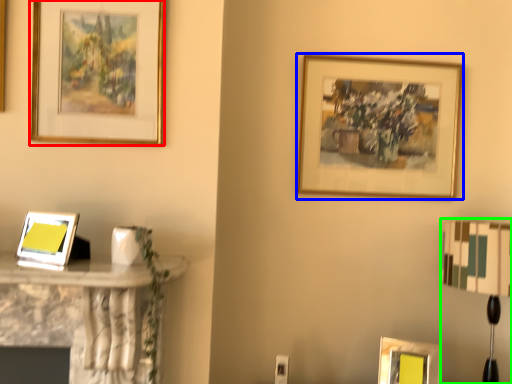
Question: Estimate the real-world distances between objects in this image. Which object is closer to picture frame (highlighted by a red box), picture frame (highlighted by a blue box) or table lamp (highlighted by a green box)?

Choices:
 (A) picture frame
 (B) table lamp

Answer: (A)